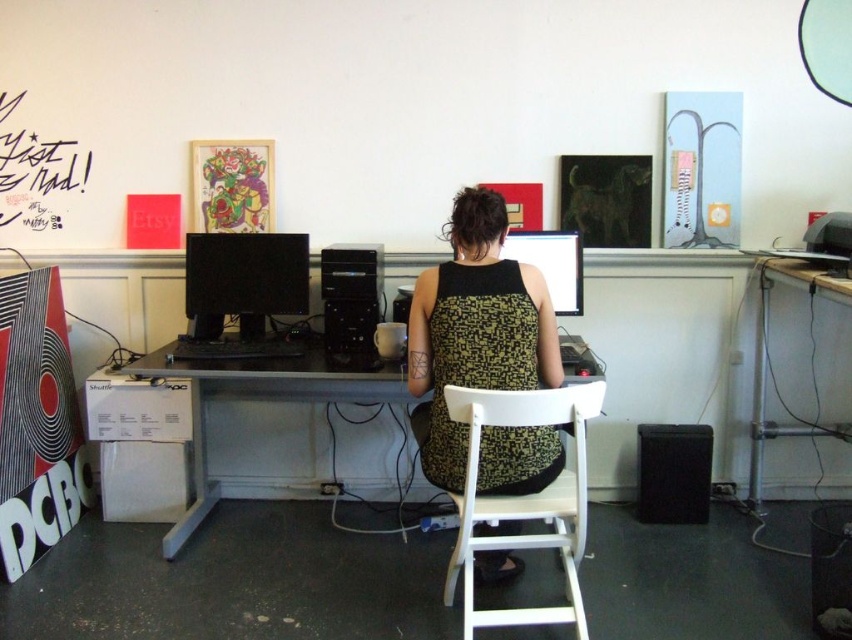
Is black matte speaker at lower right to the left of black plastic desktop computer at center from the viewer's perspective?

In fact, black matte speaker at lower right is to the right of black plastic desktop computer at center.

Who is lower down, black matte speaker at lower right or black plastic desktop computer at center?

black matte speaker at lower right

Measure the distance between black matte speaker at lower right and camera.

black matte speaker at lower right and camera are 3.13 meters apart from each other.

At what (x,y) coordinates should I click in order to perform the action: click on black matte speaker at lower right. Please return your answer as a coordinate pair (x, y). This screenshot has height=640, width=852. Looking at the image, I should click on (672, 474).

Which of these two, white plastic chair at center or black plastic monitor at center, stands taller?

Standing taller between the two is white plastic chair at center.

Measure the distance between point (534, 540) and camera.

A: A distance of 7.67 feet exists between point (534, 540) and camera.

Image resolution: width=852 pixels, height=640 pixels. What do you see at coordinates (522, 497) in the screenshot?
I see `white plastic chair at center` at bounding box center [522, 497].

I want to click on white plastic chair at center, so click(522, 497).

Who is positioned more to the left, white plastic chair at center or black matte speaker at lower right?

white plastic chair at center

Can you confirm if white plastic chair at center is positioned above black matte speaker at lower right?

Actually, white plastic chair at center is below black matte speaker at lower right.

Measure the distance between point (568, 612) and camera.

Point (568, 612) is 7.66 feet away from camera.

Locate an element on the screen. white plastic chair at center is located at coordinates (522, 497).